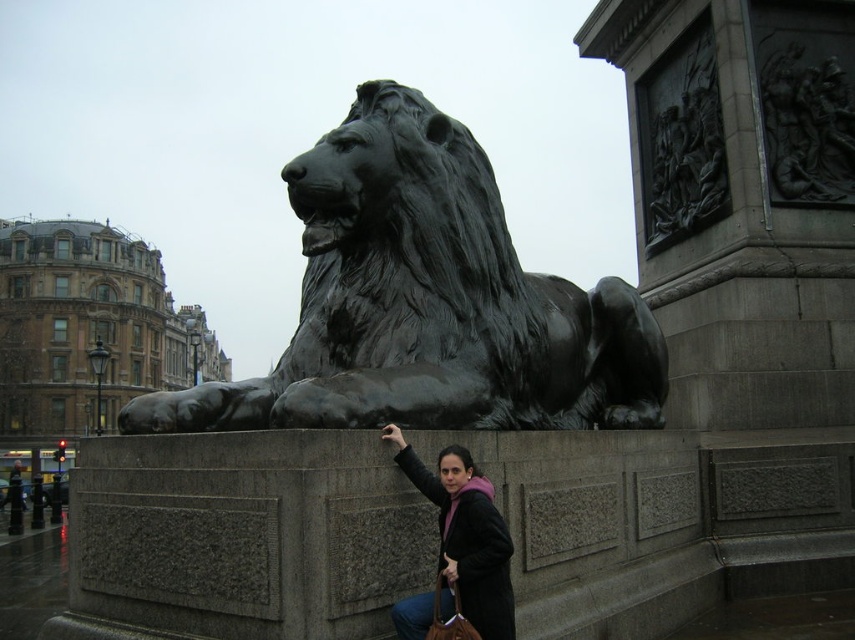
Looking at this image, who is positioned more to the right, black polished stone lion at center or matte black jacket at lower center?

matte black jacket at lower center

This screenshot has height=640, width=855. Describe the element at coordinates (426, 301) in the screenshot. I see `black polished stone lion at center` at that location.

Find the location of `black polished stone lion at center`. black polished stone lion at center is located at coordinates (426, 301).